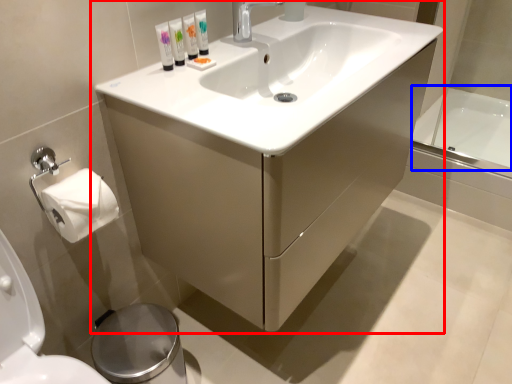
Question: Which of the following is the farthest to the observer, bathroom cabinet (highlighted by a red box) or bath (highlighted by a blue box)?

Choices:
 (A) bathroom cabinet
 (B) bath

Answer: (B)